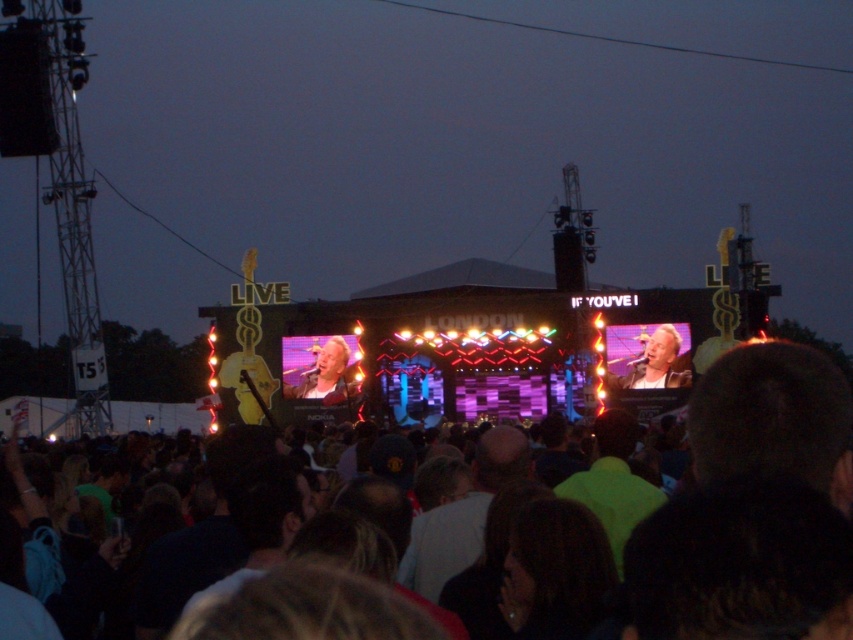
Question: Which of the following is the farthest from the observer?

Choices:
 (A) matte black jacket at center
 (B) dark hair at center
 (C) light brown leather jacket at center

Answer: (C)

Question: Is matte black jacket at center to the left of light brown leather jacket at center from the viewer's perspective?

Choices:
 (A) no
 (B) yes

Answer: (A)

Question: Which of the following is the farthest from the observer?

Choices:
 (A) matte black jacket at center
 (B) light brown leather jacket at center

Answer: (B)

Question: Is dark hair at center to the right of light brown leather jacket at center from the viewer's perspective?

Choices:
 (A) no
 (B) yes

Answer: (B)

Question: Estimate the real-world distances between objects in this image. Which object is farther from the matte black jacket at center?

Choices:
 (A) dark hair at center
 (B) light brown leather jacket at center

Answer: (B)

Question: Is dark hair at center above matte black jacket at center?

Choices:
 (A) yes
 (B) no

Answer: (B)